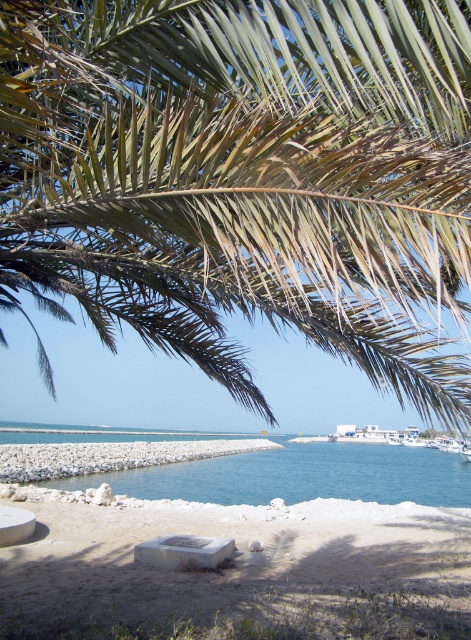
Between green leafy palm tree at upper center and blue water at center, which one appears on the right side from the viewer's perspective?

green leafy palm tree at upper center is more to the right.

Who is more forward, (409, 250) or (132, 476)?

Point (409, 250) is more forward.

Which is in front, point (430, 122) or point (132, 476)?

Point (430, 122)

Locate an element on the screen. The height and width of the screenshot is (640, 471). green leafy palm tree at upper center is located at coordinates (245, 180).

Does green leafy palm tree at upper center come behind white sand at lower center?

No.

Does green leafy palm tree at upper center appear over white sand at lower center?

Yes, green leafy palm tree at upper center is above white sand at lower center.

Is point (26, 93) less distant than point (43, 552)?

Yes, it is.

Locate an element on the screen. The height and width of the screenshot is (640, 471). green leafy palm tree at upper center is located at coordinates (245, 180).

Measure the distance between point (381, 614) and camera.

The distance of point (381, 614) from camera is 12.22 feet.

Between white sand at lower center and blue water at center, which one appears on the left side from the viewer's perspective?

From the viewer's perspective, blue water at center appears more on the left side.

Who is more forward, [285,516] or [302,472]?

Point [285,516]

Locate an element on the screen. This screenshot has height=640, width=471. white sand at lower center is located at coordinates (238, 572).